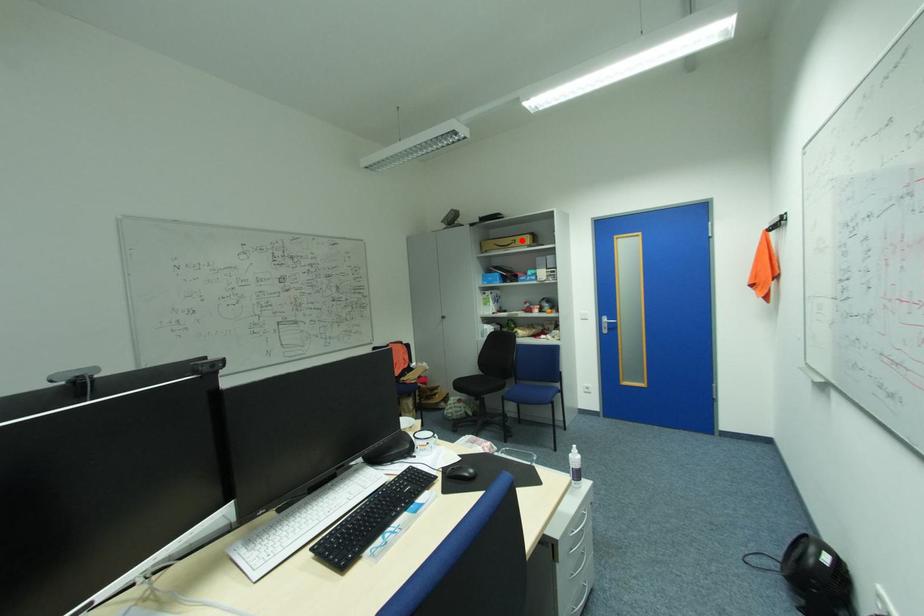
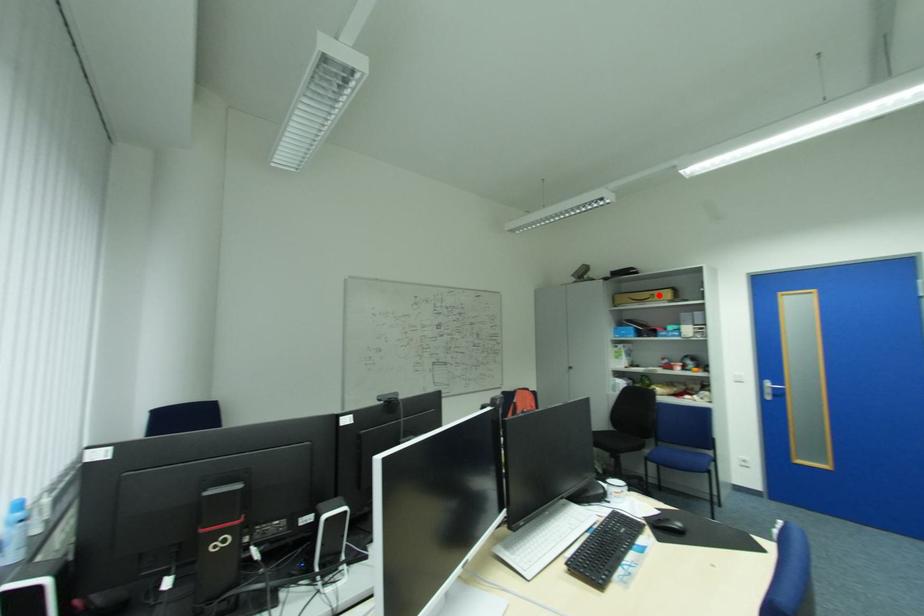
I am providing you with two images of the same scene from different viewpoints. A red point is marked on the first image and another point is marked on the second image. Does the point marked in image1 correspond to the same location as the one in image2?

Yes